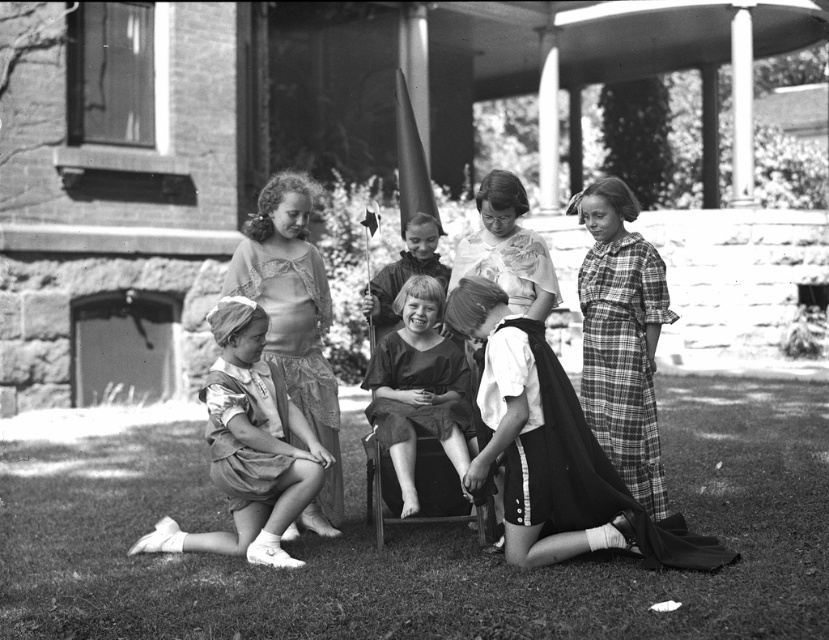
You are a photographer observing the children in the scene. You notice the plaid fabric dress at right and the matte pink blouse at center. Which child is standing farther to the right?

The plaid fabric dress at right is positioned on the right side of matte pink blouse at center, so the child wearing the plaid fabric dress at right is standing farther to the right.

In the photograph, there are two girls wearing dresses. One has a plaid fabric dress at right and the other has a dark fabric dress at center. Which dress is wider?

The dark fabric dress at center is wider than the plaid fabric dress at right.